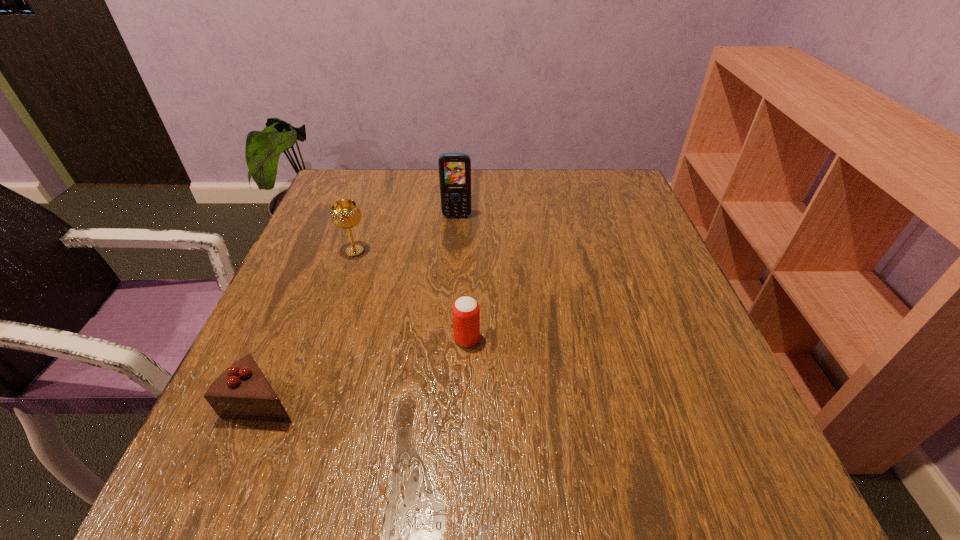
Where is `free point between the cellular telephone and the third shortest object`? free point between the cellular telephone and the third shortest object is located at coordinates (406, 234).

At what (x,y) coordinates should I click in order to perform the action: click on vacant space that's between the chocolate cake and the third shortest object. Please return your answer as a coordinate pair (x, y). This screenshot has width=960, height=540. Looking at the image, I should click on (309, 326).

In order to click on vacant space that is in between the cellular telephone and the second nearest object in this screenshot , I will do `click(462, 278)`.

Identify the location of free spot between the second nearest object and the chalice. (411, 295).

Identify the location of free space between the chocolate cake and the second farthest object. (309, 326).

You are a GUI agent. You are given a task and a screenshot of the screen. Output one action in this format:
    pyautogui.click(x=<x>, y=<y>)
    Task: Click on the vacant region between the nearest object and the cellular telephone
    
    Given the screenshot: What is the action you would take?
    pyautogui.click(x=361, y=308)

This screenshot has width=960, height=540. In order to click on unoccupied area between the cellular telephone and the second tallest object in this screenshot , I will do `click(406, 234)`.

Where is `empty space that is in between the chocolate cake and the second nearest object`? Image resolution: width=960 pixels, height=540 pixels. empty space that is in between the chocolate cake and the second nearest object is located at coordinates (366, 369).

Find the location of a particular element. object that can be found as the closest to the second farthest object is located at coordinates (454, 168).

Identify which object is located as the second nearest to the chocolate cake. Please provide its 2D coordinates. Your answer should be formatted as a tuple, i.e. [(x, y)], where the tuple contains the x and y coordinates of a point satisfying the conditions above.

[(346, 213)]